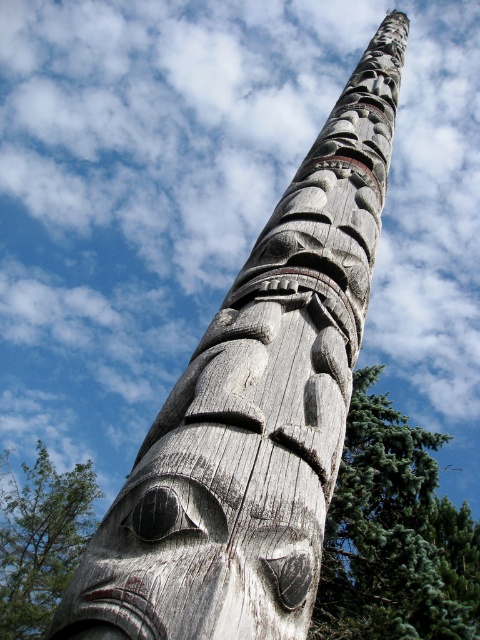
Question: Which of the following is the closest to the observer?

Choices:
 (A) green textured tree at lower left
 (B) green needle-like tree at center

Answer: (B)

Question: Can you confirm if green needle-like tree at center is positioned above green textured tree at lower left?

Choices:
 (A) no
 (B) yes

Answer: (B)

Question: Can you confirm if gray wood totem pole at center is bigger than green textured tree at lower left?

Choices:
 (A) no
 (B) yes

Answer: (B)

Question: Considering the real-world distances, which object is farthest from the green textured tree at lower left?

Choices:
 (A) gray wood totem pole at center
 (B) green needle-like tree at center

Answer: (B)

Question: Can you confirm if green needle-like tree at center is positioned below green textured tree at lower left?

Choices:
 (A) no
 (B) yes

Answer: (A)

Question: Which point is closer to the camera?

Choices:
 (A) (439, 436)
 (B) (4, 525)

Answer: (A)